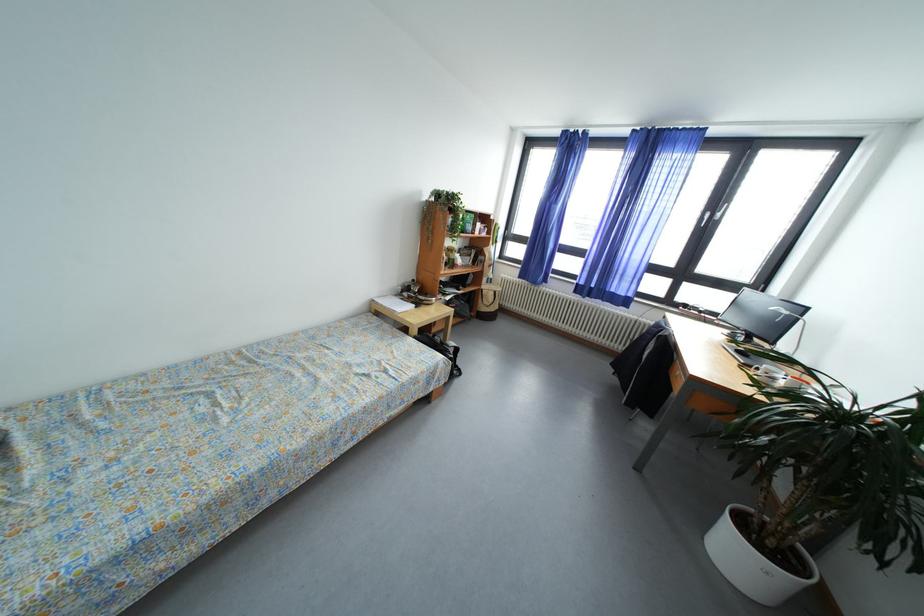
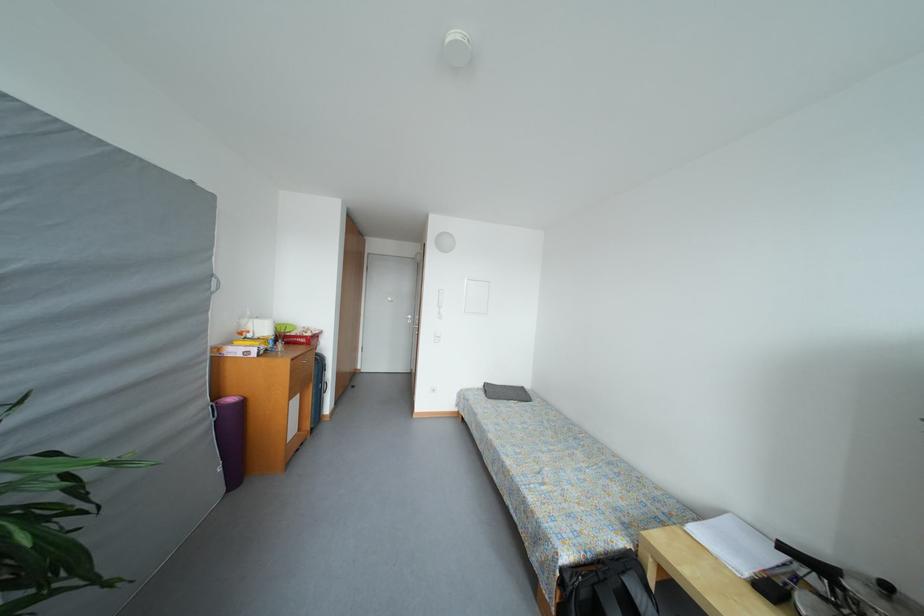
Find the pixel in the second image that matches pixel 419 285 in the first image.

(893, 591)